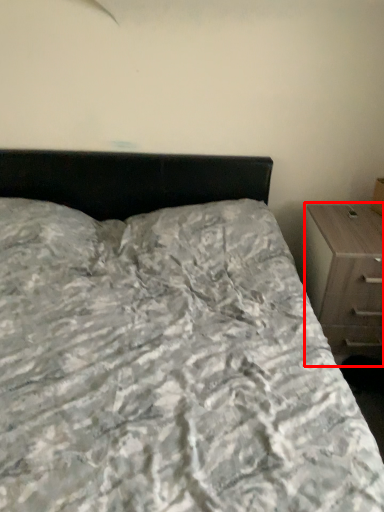
Question: From the image's perspective, where is chest of drawers (annotated by the red box) located in relation to bed in the image?

Choices:
 (A) below
 (B) above

Answer: (B)